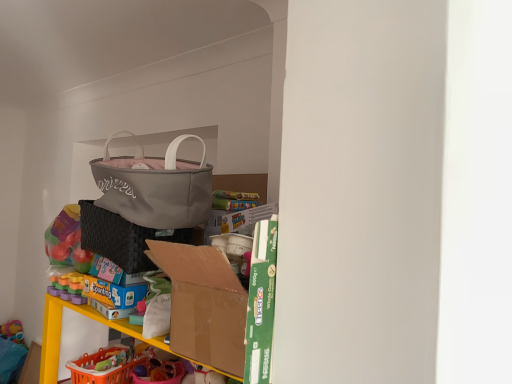
Question: From the image's perspective, is matte gray handbag at upper center above or below black woven laundry basket at center?

Choices:
 (A) below
 (B) above

Answer: (B)

Question: Considering the positions of matte gray handbag at upper center and black woven laundry basket at center in the image, is matte gray handbag at upper center bigger or smaller than black woven laundry basket at center?

Choices:
 (A) small
 (B) big

Answer: (B)

Question: Estimate the real-world distances between objects in this image. Which object is farther from the matte gray handbag at upper center?

Choices:
 (A) cardboard box at center
 (B) black woven laundry basket at center

Answer: (A)

Question: Based on their relative distances, which object is nearer to the black woven laundry basket at center?

Choices:
 (A) matte gray handbag at upper center
 (B) cardboard box at center

Answer: (A)